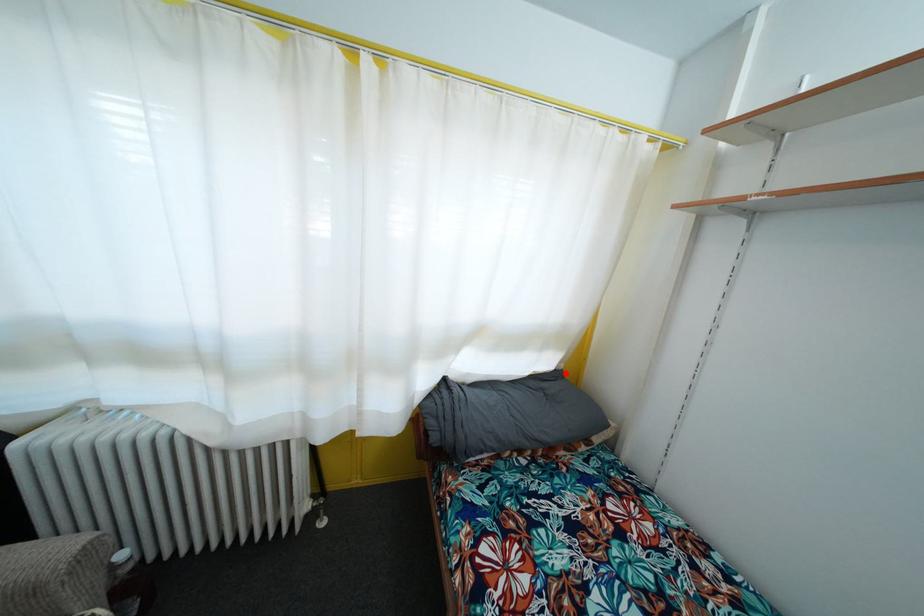
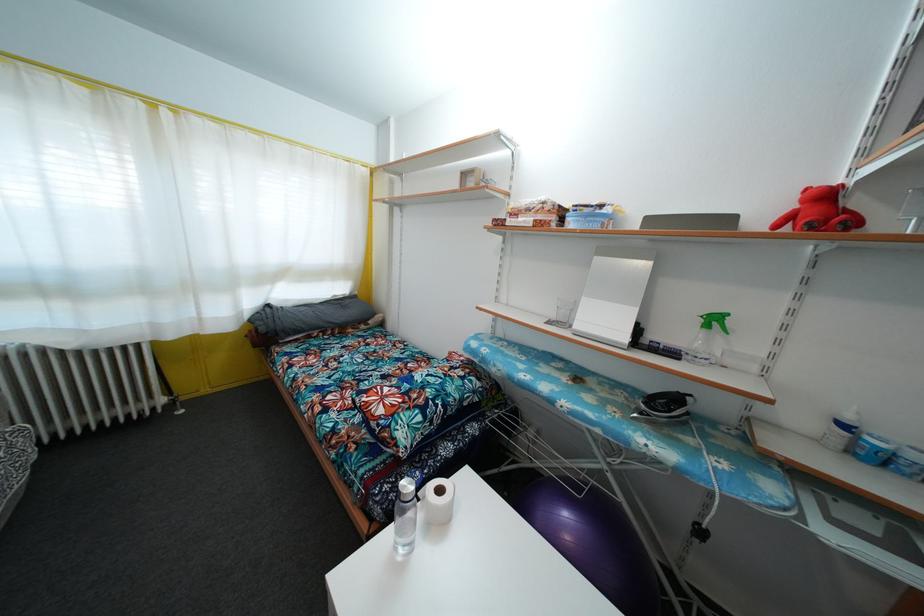
Find the pixel in the second image that matches the highlighted location in the first image.

(359, 300)